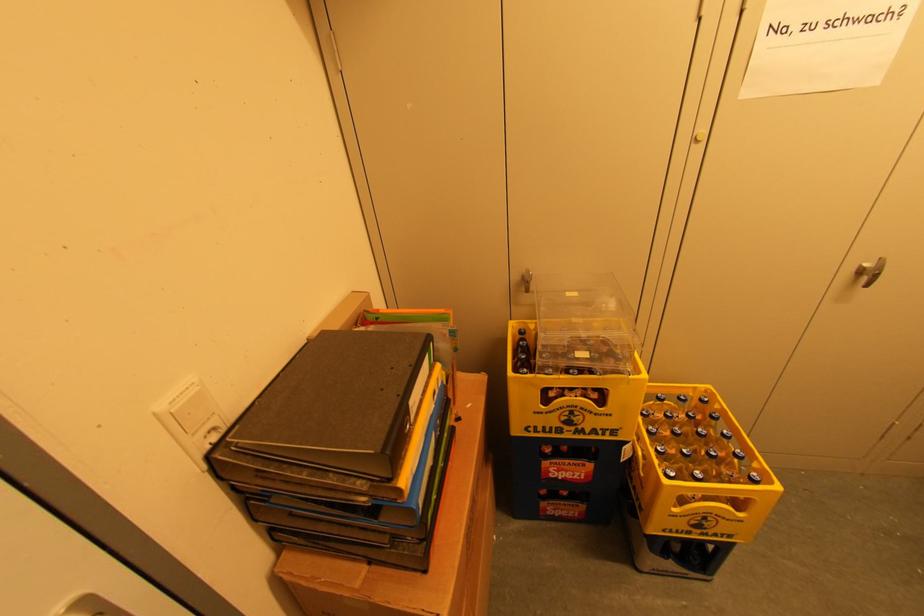
I want to click on white paper sheet, so click(x=823, y=45).